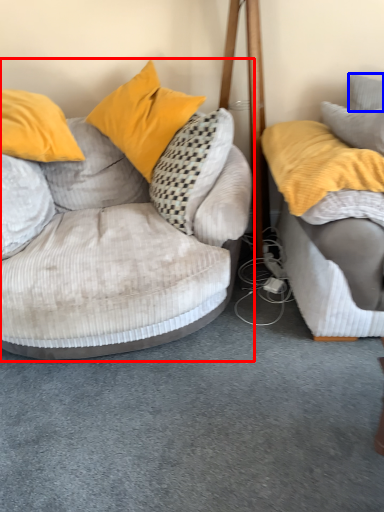
Question: Which object appears closest to the camera in this image, studio couch (highlighted by a red box) or pillow (highlighted by a blue box)?

Choices:
 (A) studio couch
 (B) pillow

Answer: (A)